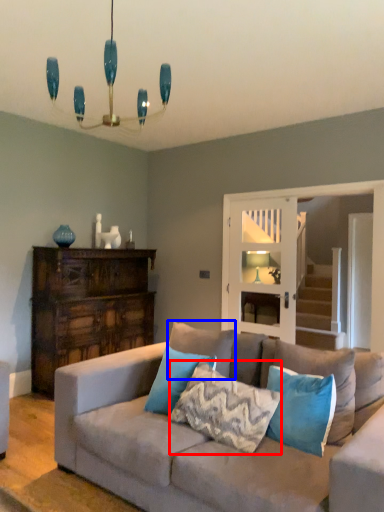
Question: Which object is further to the camera taking this photo, pillow (highlighted by a red box) or pillow (highlighted by a blue box)?

Choices:
 (A) pillow
 (B) pillow

Answer: (B)